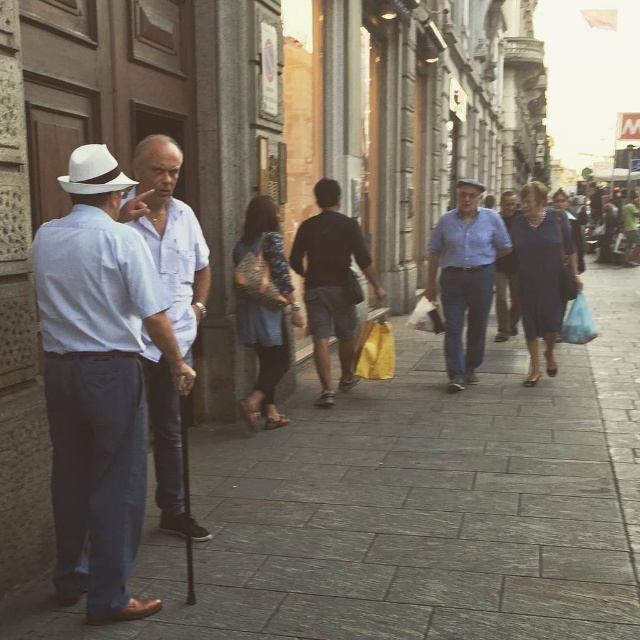
Can you confirm if light blue cotton shirt at left is positioned to the left of blue denim jeans at center?

Yes, light blue cotton shirt at left is to the left of blue denim jeans at center.

Does light blue cotton shirt at left lie in front of blue denim jeans at center?

Yes, it is.

Is point (93, 497) behind point (512, 260)?

No, (93, 497) is closer to viewer.

At what (x,y) coordinates should I click in order to perform the action: click on light blue cotton shirt at left. Please return your answer as a coordinate pair (x, y). Looking at the image, I should click on (99, 381).

Which is in front, point (177, 296) or point (349, 316)?

Point (177, 296) is more forward.

What do you see at coordinates (170, 234) in the screenshot? I see `matte white shirt at center` at bounding box center [170, 234].

The height and width of the screenshot is (640, 640). I want to click on matte white shirt at center, so click(170, 234).

Who is more distant from viewer, (x=342, y=272) or (x=76, y=176)?

The point (x=342, y=272) is more distant.

Is point (323, 294) positioned in front of point (77, 188)?

No.

Does point (328, 266) come behind point (102, 170)?

Yes, it is behind point (102, 170).

Where is `black matte shorts at center`? The width and height of the screenshot is (640, 640). black matte shorts at center is located at coordinates (332, 284).